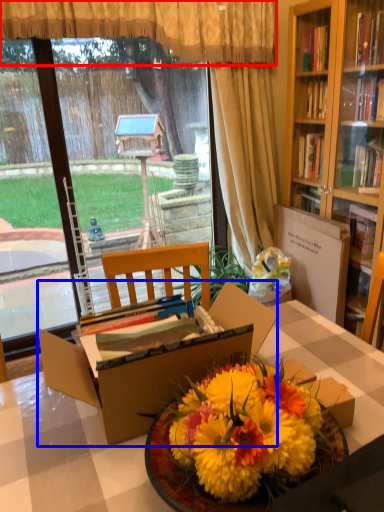
Question: Which of the following is the closest to the observer, curtain (highlighted by a red box) or box (highlighted by a blue box)?

Choices:
 (A) curtain
 (B) box

Answer: (B)